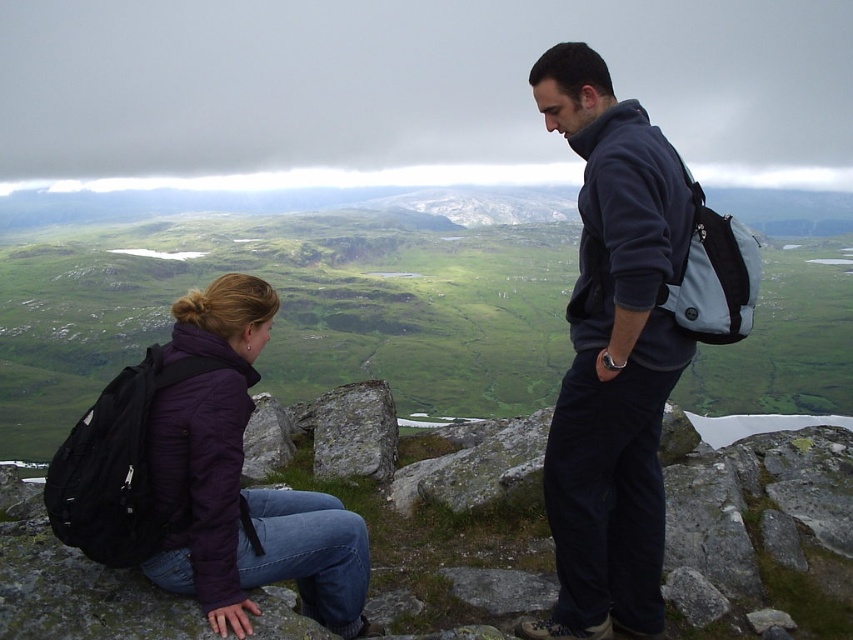
Does dark blue fleece jacket at center have a greater height compared to gray rough rock at center?

Yes, dark blue fleece jacket at center is taller than gray rough rock at center.

Does point (602, 576) come closer to viewer compared to point (393, 452)?

Yes, point (602, 576) is closer to viewer.

Find the location of a particular element. The height and width of the screenshot is (640, 853). dark blue fleece jacket at center is located at coordinates (612, 355).

Who is shorter, purple matte jacket at lower left or gray rough rock at center?

gray rough rock at center is shorter.

Does point (213, 474) come behind point (368, 420)?

No, (213, 474) is in front of (368, 420).

Does point (258, 516) lie in front of point (326, 458)?

That is True.

Image resolution: width=853 pixels, height=640 pixels. Find the location of `purple matte jacket at lower left`. purple matte jacket at lower left is located at coordinates (239, 481).

Which is more to the right, dark blue fleece jacket at center or purple matte jacket at lower left?

Positioned to the right is dark blue fleece jacket at center.

Is dark blue fleece jacket at center smaller than purple matte jacket at lower left?

No.

Which is in front, point (621, 612) or point (196, 566)?

Point (196, 566) is more forward.

In order to click on dark blue fleece jacket at center in this screenshot , I will do `click(612, 355)`.